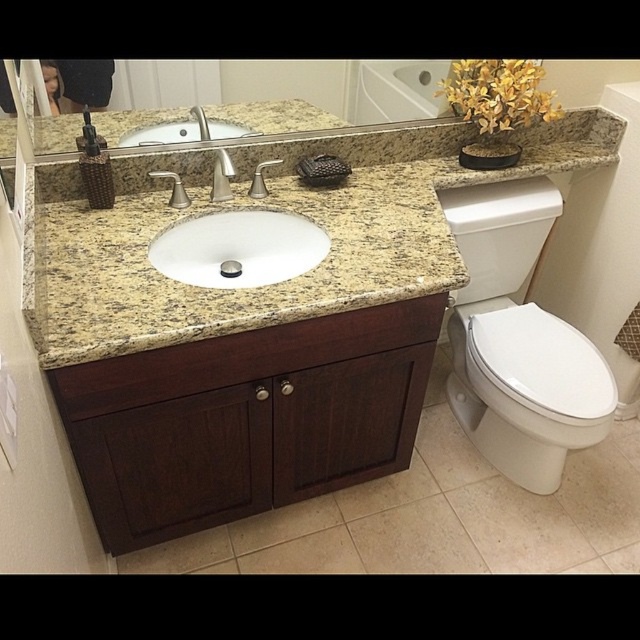
Question: Is yellow granite countertop at center positioned at the back of white glossy sink at center?

Choices:
 (A) yes
 (B) no

Answer: (B)

Question: Among these points, which one is farthest from the camera?

Choices:
 (A) (474, 220)
 (B) (433, 284)
 (C) (324, 116)

Answer: (A)

Question: Can you confirm if satin nickel faucet at center is positioned to the left of silver metallic faucet at upper center?

Choices:
 (A) no
 (B) yes

Answer: (A)

Question: Which point is farther from the camera taking this photo?

Choices:
 (A) (212, 182)
 (B) (257, 269)
 (C) (307, 132)
 (D) (196, 115)

Answer: (C)

Question: Which object is farther from the camera taking this photo?

Choices:
 (A) white glossy toilet bowl at right
 (B) silver metallic faucet at upper center

Answer: (A)

Question: Does white glossy sink at center come behind satin nickel faucet at center?

Choices:
 (A) yes
 (B) no

Answer: (B)